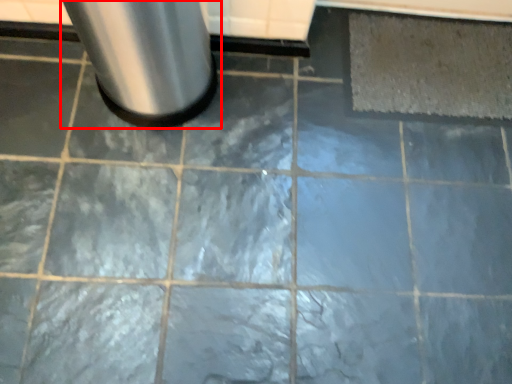
Question: From the image's perspective, what is the correct spatial relationship of waste container (annotated by the red box) in relation to mat?

Choices:
 (A) above
 (B) below

Answer: (B)